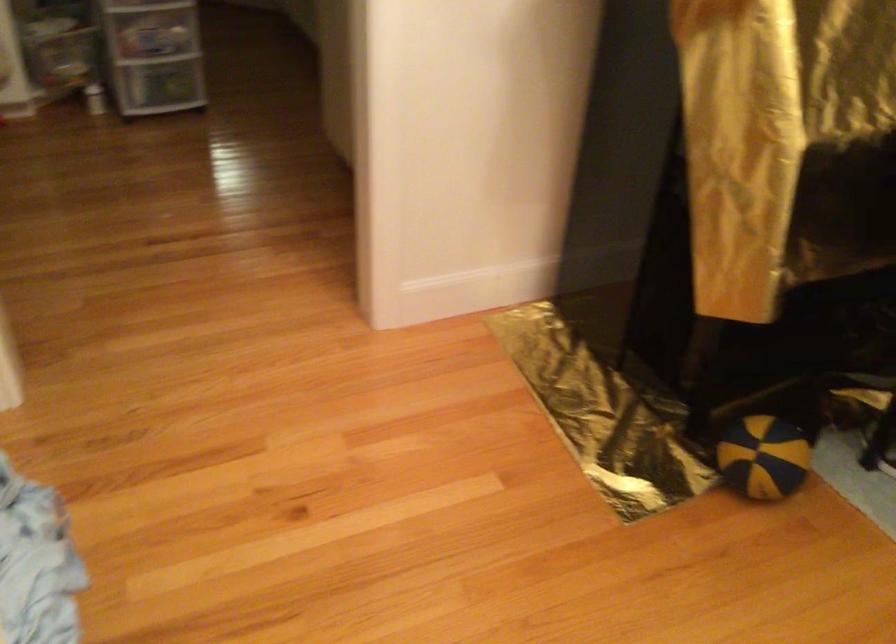
The image size is (896, 644). Find the location of `blue and yellow ball`. blue and yellow ball is located at coordinates (762, 457).